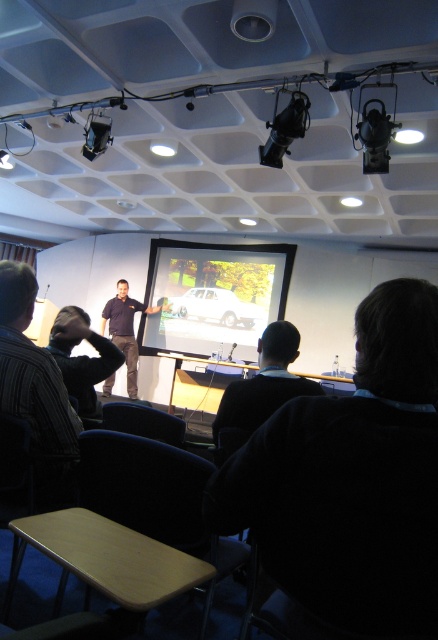
You are sitting in the front row of the conference room and notice two points marked on the projector screen. Which point is closer to you, point (x=98, y=356) or point (x=96, y=138)?

Point (x=98, y=356) is closer to you than point (x=96, y=138) because it is positioned closer to the viewer according to the spatial description.

You are sitting in the conference room and want to see both the matte white screen at center and the dark brown hair at lower center. Which object is located to the left when viewed from your seat?

The matte white screen at center is positioned on the left side of dark brown hair at lower center, so when viewed from your seat, the matte white screen at center is to the left of the dark brown hair at lower center.

You are sitting in the conference room and want to determine the relative positions of two points marked on the floor. The first point is at coordinates point (382, 484) and the second is at point (144, 330). From your seated position, which point is closer to the front of the room?

Point (382, 484) is in front of point (144, 330), so from your seated position facing the front of the room, point (382, 484) is closer to the front.